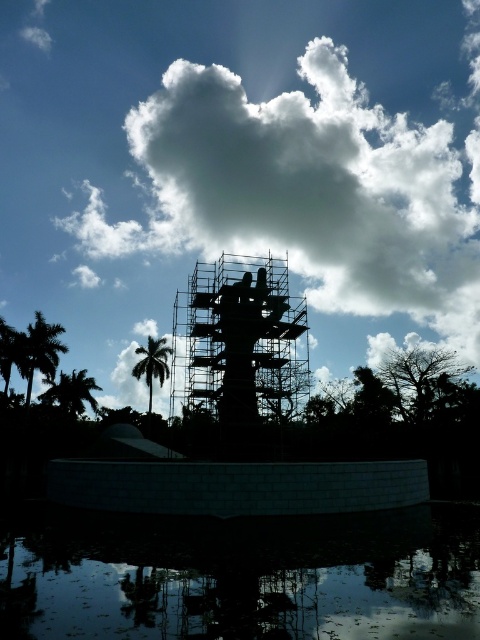
Question: Among these points, which one is nearest to the camera?

Choices:
 (A) (32, 330)
 (B) (148, 372)

Answer: (A)

Question: Can you confirm if transparent glass water at lower center is positioned below green leafy palm tree at left?

Choices:
 (A) no
 (B) yes

Answer: (B)

Question: Among these objects, which one is farthest from the camera?

Choices:
 (A) scaffolding metal structure at center
 (B) green leafy palm tree at left
 (C) transparent glass water at lower center

Answer: (B)

Question: Which object is the farthest from the green leafy palm tree at left?

Choices:
 (A) green leafy palm tree at center
 (B) green leafy palm tree at lower left
 (C) white fluffy cloud at upper center

Answer: (C)

Question: Does green leafy palm tree at left appear on the left side of green leafy palm tree at center?

Choices:
 (A) yes
 (B) no

Answer: (A)

Question: From the image, what is the correct spatial relationship of white fluffy cloud at upper center in relation to green leafy palm tree at left?

Choices:
 (A) right
 (B) left

Answer: (A)